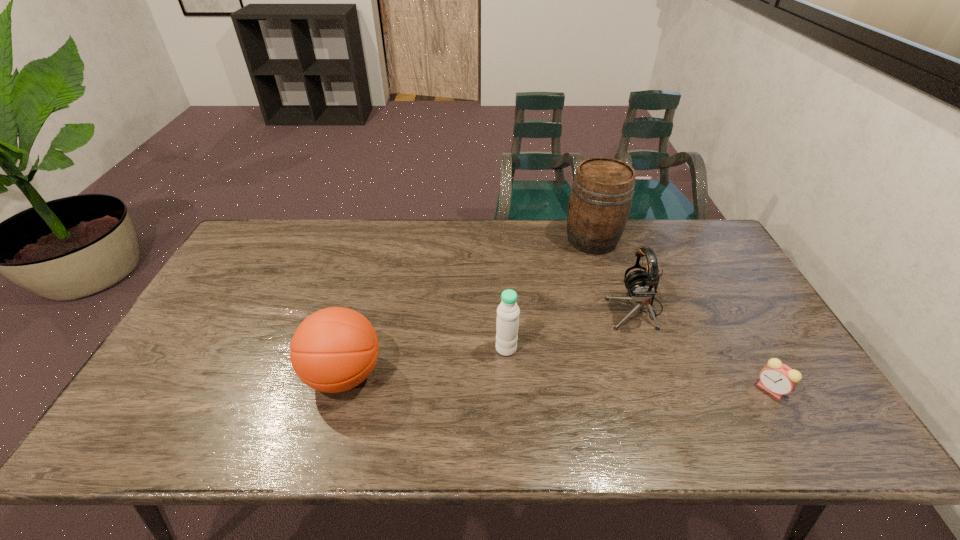
Find the location of a particular element. The image size is (960, 540). vacant space located 0.190m on the right of the second farthest object is located at coordinates (729, 309).

This screenshot has width=960, height=540. Find the location of `vacant space situated 0.400m on the back of the fourth object from right to left`. vacant space situated 0.400m on the back of the fourth object from right to left is located at coordinates (500, 248).

In order to click on vacant space located on the back of the leftmost object in this screenshot , I will do `click(375, 260)`.

Locate an element on the screen. free space located 0.240m on the face of the shortest object is located at coordinates (659, 389).

Where is `free space located 0.340m on the face of the shortest object`? free space located 0.340m on the face of the shortest object is located at coordinates (618, 389).

In order to click on vacant region located on the face of the shortest object in this screenshot , I will do [x=667, y=389].

You are a GUI agent. You are given a task and a screenshot of the screen. Output one action in this format:
    pyautogui.click(x=<x>, y=<y>)
    Task: Click on the object present at the far edge
    This screenshot has width=960, height=540.
    Given the screenshot: What is the action you would take?
    pyautogui.click(x=601, y=196)

You are a GUI agent. You are given a task and a screenshot of the screen. Output one action in this format:
    pyautogui.click(x=<x>, y=<y>)
    Task: Click on the object that is at the right edge
    The image size is (960, 540).
    Given the screenshot: What is the action you would take?
    pyautogui.click(x=778, y=379)

In the image, there is a desktop. At what (x,y) coordinates should I click in order to perform the action: click on vacant space at the far edge. Please return your answer as a coordinate pair (x, y). The width and height of the screenshot is (960, 540). Looking at the image, I should click on (440, 234).

This screenshot has height=540, width=960. Find the location of `vacant region at the near edge of the desktop`. vacant region at the near edge of the desktop is located at coordinates (228, 442).